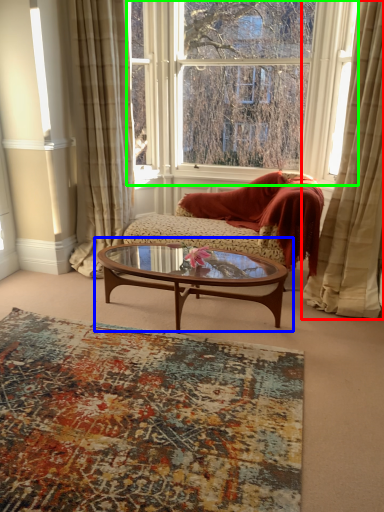
Question: Which is nearer to the curtain (highlighted by a red box)? coffee table (highlighted by a blue box) or window (highlighted by a green box).

Choices:
 (A) coffee table
 (B) window

Answer: (A)